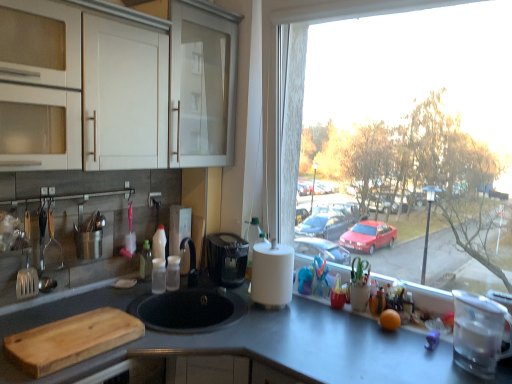
Question: Which direction should I rotate to look at satin nickel faucet at center, positioned as the 1th appliance in left-to-right order?

Choices:
 (A) left
 (B) right

Answer: (A)

Question: From a real-world perspective, is wooden cutting board at lower left physically above satin nickel faucet at center, placed as the second appliance when sorted from front to back?

Choices:
 (A) yes
 (B) no

Answer: (B)

Question: Is wooden cutting board at lower left not inside satin nickel faucet at center, placed as the second appliance when sorted from right to left?

Choices:
 (A) no
 (B) yes

Answer: (B)

Question: Are wooden cutting board at lower left and satin nickel faucet at center, which appears as the first appliance when viewed from the back, far apart?

Choices:
 (A) no
 (B) yes

Answer: (A)

Question: Could you tell me if wooden cutting board at lower left is turned towards satin nickel faucet at center, which appears as the first appliance when viewed from the back?

Choices:
 (A) no
 (B) yes

Answer: (A)

Question: Considering the relative sizes of wooden cutting board at lower left and satin nickel faucet at center, placed as the second appliance when sorted from right to left, in the image provided, is wooden cutting board at lower left shorter than satin nickel faucet at center, placed as the second appliance when sorted from right to left,?

Choices:
 (A) no
 (B) yes

Answer: (B)

Question: Does wooden cutting board at lower left come in front of satin nickel faucet at center, which appears as the first appliance when viewed from the back?

Choices:
 (A) no
 (B) yes

Answer: (B)

Question: Is white glossy cabinet at upper left thinner than smooth gray countertop at center?

Choices:
 (A) no
 (B) yes

Answer: (B)

Question: Can you confirm if white glossy cabinet at upper left is positioned to the right of smooth gray countertop at center?

Choices:
 (A) no
 (B) yes

Answer: (A)

Question: Is white glossy cabinet at upper left not within smooth gray countertop at center?

Choices:
 (A) yes
 (B) no

Answer: (A)

Question: Is white glossy cabinet at upper left positioned far away from smooth gray countertop at center?

Choices:
 (A) no
 (B) yes

Answer: (A)

Question: Considering the relative sizes of white glossy cabinet at upper left and smooth gray countertop at center in the image provided, is white glossy cabinet at upper left taller than smooth gray countertop at center?

Choices:
 (A) no
 (B) yes

Answer: (A)

Question: Is white glossy cabinet at upper left further to camera compared to smooth gray countertop at center?

Choices:
 (A) no
 (B) yes

Answer: (B)

Question: Is satin nickel faucet at center, positioned as the 1th appliance in left-to-right order, facing towards smooth gray countertop at center?

Choices:
 (A) no
 (B) yes

Answer: (A)